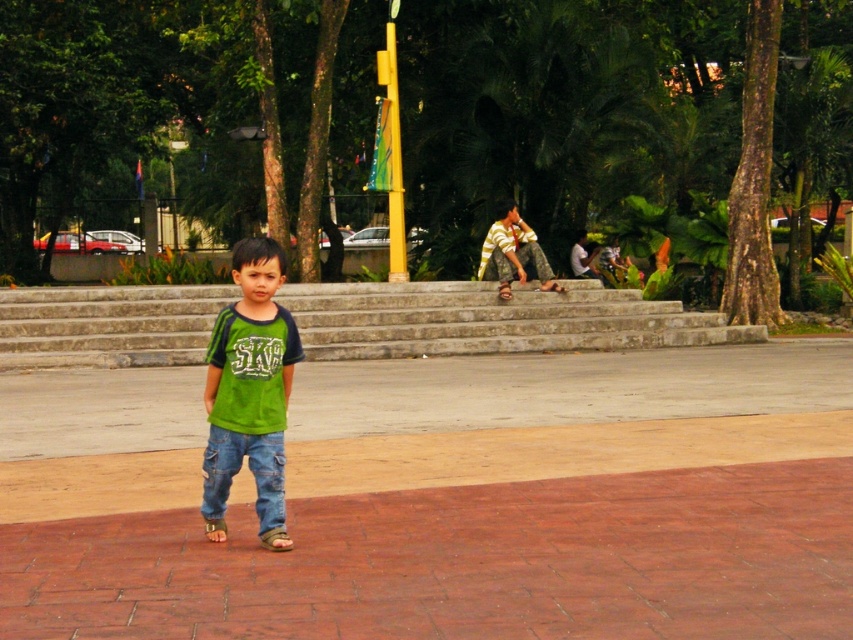
Question: Which of the following is the farthest from the observer?

Choices:
 (A) green cotton shirt at center
 (B) gray stone stairs at center

Answer: (B)

Question: Is denim pants at center above yellow striped shirt at center?

Choices:
 (A) yes
 (B) no

Answer: (B)

Question: Among these objects, which one is farthest from the camera?

Choices:
 (A) yellow striped shirt at center
 (B) denim pants at center
 (C) brown brick pavement at center
 (D) gray stone stairs at center

Answer: (A)

Question: Does gray stone stairs at center lie in front of yellow striped shirt at center?

Choices:
 (A) no
 (B) yes

Answer: (B)

Question: Is brown brick pavement at center to the right of yellow striped shirt at center from the viewer's perspective?

Choices:
 (A) no
 (B) yes

Answer: (A)

Question: Which point is closer to the camera?

Choices:
 (A) (260, 493)
 (B) (283, 420)
 (C) (355, 310)

Answer: (A)